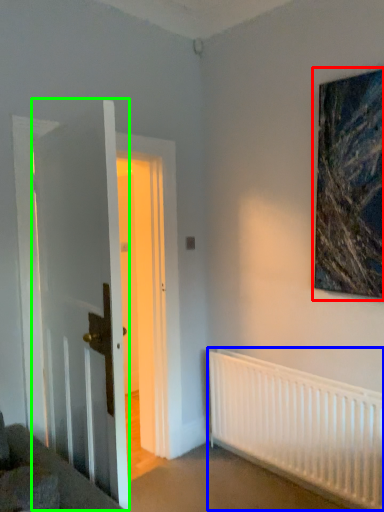
Question: Considering the real-world distances, which object is farthest from picture frame (highlighted by a red box)? radiator (highlighted by a blue box) or door (highlighted by a green box)?

Choices:
 (A) radiator
 (B) door

Answer: (B)